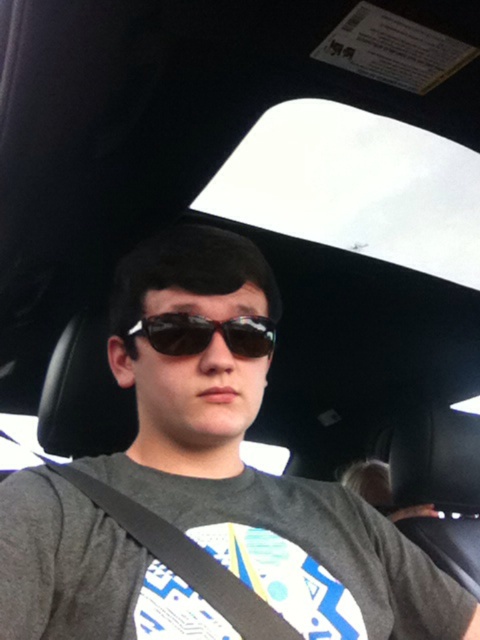
Find the location of a particular element. matte black sunglasses at center is located at coordinates (251, 468).

Can you confirm if matte black sunglasses at center is wider than black fabric seatbelt at center?

Correct, the width of matte black sunglasses at center exceeds that of black fabric seatbelt at center.

Between point (41, 573) and point (124, 531), which one is positioned behind?

Point (124, 531)

Image resolution: width=480 pixels, height=640 pixels. I want to click on matte black sunglasses at center, so click(x=251, y=468).

Between point (139, 538) and point (186, 312), which one is positioned in front?

Point (139, 538)

Is point (165, 556) closer to camera compared to point (253, 324)?

That is True.

Is point (158, 522) positioned before point (263, 353)?

Yes, it is.

The width and height of the screenshot is (480, 640). I want to click on black fabric seatbelt at center, so click(x=183, y=560).

Is point (363, 515) behind point (143, 328)?

Yes, it is.

Does matte black sunglasses at center have a lesser width compared to sunglasses at center?

No, matte black sunglasses at center is not thinner than sunglasses at center.

Image resolution: width=480 pixels, height=640 pixels. I want to click on matte black sunglasses at center, so click(x=251, y=468).